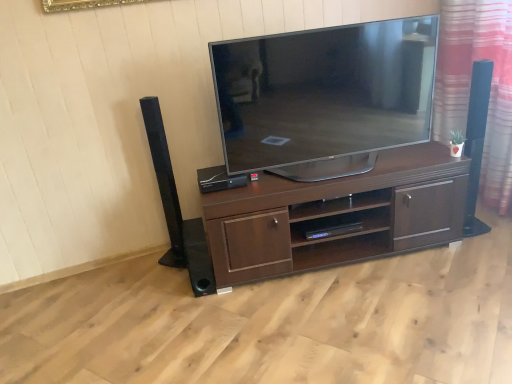
Identify the location of free space in front of dark brown wood tv stand at center. (357, 317).